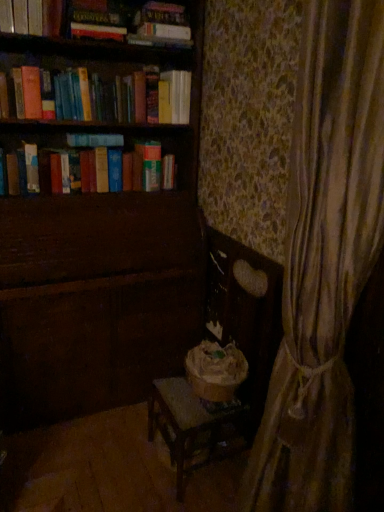
Question: In the image, is wooden chair at lower center positioned in front of or behind hardcover book at upper left?

Choices:
 (A) front
 (B) behind

Answer: (A)

Question: From the image's perspective, relative to hardcover book at upper left, is wooden chair at lower center above or below?

Choices:
 (A) above
 (B) below

Answer: (B)

Question: Considering the real-world distances, which object is farthest from the wooden chair at lower center?

Choices:
 (A) hardcover book at upper center, which ranks as the 2th paperback book in bottom-to-top order
 (B) hardcover book at left, placed as the third paperback book when sorted from top to bottom
 (C) hardcover book at upper center, which ranks as the 3th paperback book in left-to-right order
 (D) wooden rocking chair at center
 (E) hardcover book at upper left

Answer: (C)

Question: Considering the real-world distances, which object is closest to the hardcover book at upper center, which ranks as the 2th paperback book in bottom-to-top order?

Choices:
 (A) wooden chair at lower center
 (B) hardcover book at left, which is the third paperback book in right-to-left order
 (C) wooden rocking chair at center
 (D) hardcover book at upper left
 (E) hardcover book at upper center, marked as the 1th paperback book in a top-to-bottom arrangement

Answer: (D)